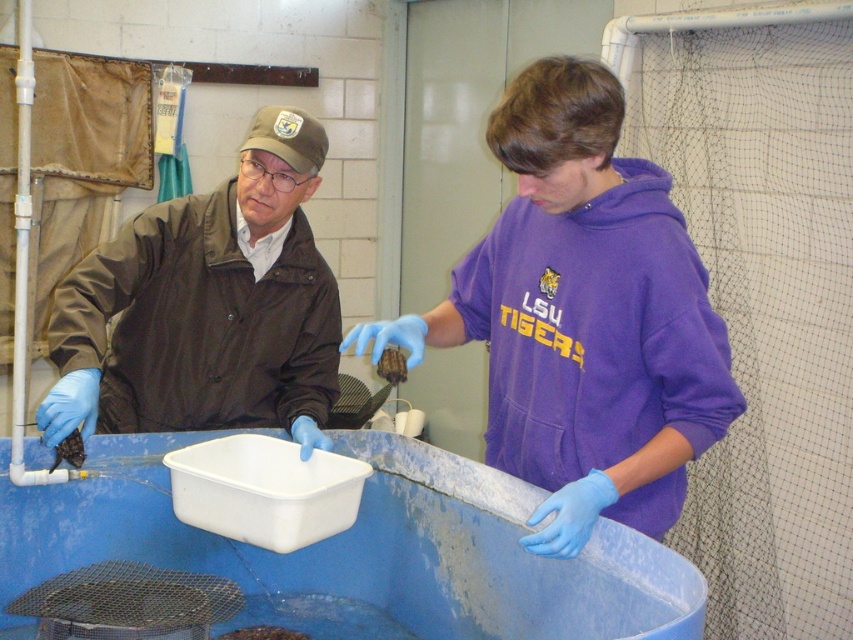
You are standing in the image and want to touch the point at coordinates (x=583, y=316). Which object will you be touching?

The point at coordinates (x=583, y=316) is on the purple fleece hoodie at center, so you will be touching the purple fleece hoodie at center.

You are a researcher observing the scene. You need to identify the positions of the two people based on their clothing. Which person is wearing the purple fleece hoodie at center and is positioned to the right of the brown matte jacket at left?

The purple fleece hoodie at center is to the right of the brown matte jacket at left.

You are a researcher observing the scene. You need to determine which clothing item is larger in size between the purple fleece hoodie at center and the brown matte jacket at left. Based on the description, which one is bigger?

The purple fleece hoodie at center is bigger than the brown matte jacket at left according to the description.